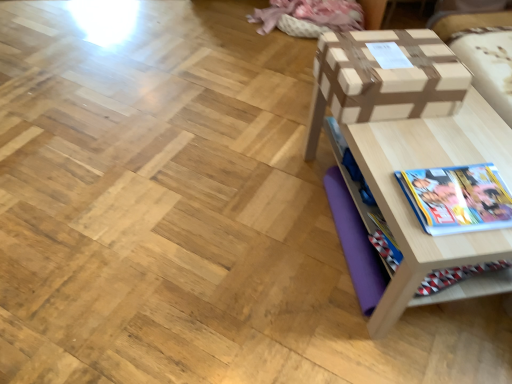
The width and height of the screenshot is (512, 384). Identify the location of wooden table at right. (409, 143).

Consider the image. From a real-world perspective, between hardcover book at lower right and wooden table at right, who is vertically higher?

hardcover book at lower right is physically above.

Locate an element on the screen. This screenshot has height=384, width=512. table in front of the hardcover book at lower right is located at coordinates (409, 143).

Is hardcover book at lower right directly adjacent to wooden table at right?

hardcover book at lower right is not next to wooden table at right, and they're not touching.

From the picture: How different are the orientations of hardcover book at lower right and wooden table at right in degrees?

hardcover book at lower right and wooden table at right are facing 0.21 degrees away from each other.

Is point (395, 69) closer to viewer compared to point (460, 190)?

No, it is not.

Based on the photo, is brown cardboard box at upper right spatially inside hardcover book at lower right, or outside of it?

The correct answer is: outside.

Is brown cardboard box at upper right aimed at hardcover book at lower right?

No, brown cardboard box at upper right is not oriented towards hardcover book at lower right.

Are brown cardboard box at upper right and hardcover book at lower right located far from each other?

No, brown cardboard box at upper right is not far away from hardcover book at lower right.

Who is shorter, hardcover book at lower right or brown cardboard box at upper right?

Standing shorter between the two is hardcover book at lower right.

What's the angular difference between hardcover book at lower right and brown cardboard box at upper right's facing directions?

They differ by 89.8 degrees in their facing directions.

This screenshot has width=512, height=384. Find the location of `box above the hardcover book at lower right (from a real-world perspective)`. box above the hardcover book at lower right (from a real-world perspective) is located at coordinates click(x=387, y=77).

Is brown cardboard box at upper right in front of or behind wooden table at right in the image?

Clearly, brown cardboard box at upper right is behind wooden table at right.

I want to click on box that appears above the wooden table at right (from the image's perspective), so click(x=387, y=77).

From the image's perspective, relative to wooden table at right, is brown cardboard box at upper right above or below?

Clearly, from the image's perspective, brown cardboard box at upper right is above wooden table at right.

In the scene shown: Which of these two, brown cardboard box at upper right or wooden table at right, is smaller?

Smaller between the two is brown cardboard box at upper right.

Who is taller, wooden table at right or hardcover book at lower right?

wooden table at right.

Is wooden table at right beside hardcover book at lower right?

No, wooden table at right is not with hardcover book at lower right.

Based on the photo, in terms of height, does wooden table at right look taller or shorter compared to brown cardboard box at upper right?

Considering their sizes, wooden table at right has more height than brown cardboard box at upper right.

Between wooden table at right and brown cardboard box at upper right, which one has smaller size?

brown cardboard box at upper right is smaller.

Is wooden table at right facing towards brown cardboard box at upper right?

No, wooden table at right is not turned towards brown cardboard box at upper right.

Can you confirm if wooden table at right is wider than brown cardboard box at upper right?

Indeed, wooden table at right has a greater width compared to brown cardboard box at upper right.

The image size is (512, 384). Find the location of `table on the right of the hardcover book at lower right`. table on the right of the hardcover book at lower right is located at coordinates (409, 143).

This screenshot has height=384, width=512. What are the coordinates of `box above the hardcover book at lower right (from the image's perspective)` in the screenshot? It's located at (387, 77).

Estimate the real-world distances between objects in this image. Which object is further from wooden table at right, brown cardboard box at upper right or hardcover book at lower right?

The object further to wooden table at right is hardcover book at lower right.

Estimate the real-world distances between objects in this image. Which object is further from hardcover book at lower right, brown cardboard box at upper right or wooden table at right?

The object further to hardcover book at lower right is brown cardboard box at upper right.

When comparing their distances from wooden table at right, does hardcover book at lower right or brown cardboard box at upper right seem closer?

Based on the image, brown cardboard box at upper right appears to be nearer to wooden table at right.

Considering their positions, is wooden table at right positioned closer to hardcover book at lower right than brown cardboard box at upper right?

wooden table at right is positioned closer to the anchor hardcover book at lower right.

Which object lies further to the anchor point brown cardboard box at upper right, hardcover book at lower right or wooden table at right?

hardcover book at lower right is further to brown cardboard box at upper right.

When comparing their distances from brown cardboard box at upper right, does wooden table at right or hardcover book at lower right seem further?

Among the two, hardcover book at lower right is located further to brown cardboard box at upper right.

You are a GUI agent. You are given a task and a screenshot of the screen. Output one action in this format:
    pyautogui.click(x=<x>, y=<y>)
    Task: Click on the table between brown cardboard box at upper right and hardcover book at lower right from top to bottom
    The height and width of the screenshot is (384, 512).
    Given the screenshot: What is the action you would take?
    pyautogui.click(x=409, y=143)